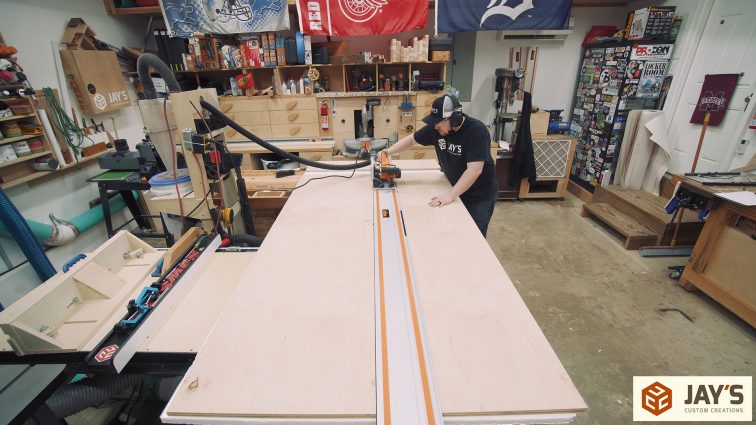
Identify the location of wood pannels. The width and height of the screenshot is (756, 425). point(305,328), point(224,288), point(475,310).